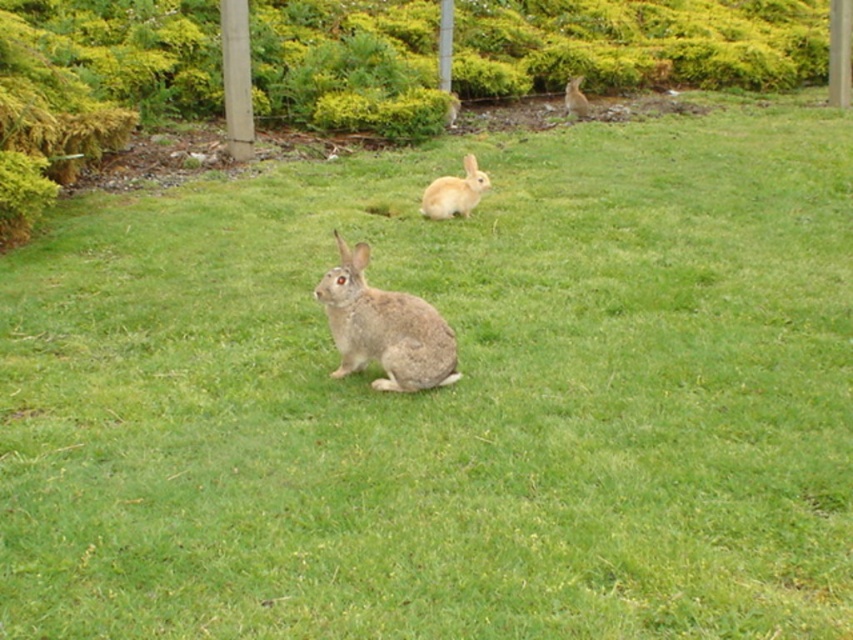
You are a photographer trying to capture a photo of the fuzzy brown rabbit at center and the fuzzy brown rabbit at upper center. Which rabbit would appear smaller in your photo?

The fuzzy brown rabbit at center appears smaller in the photo because it has a lesser height compared to the fuzzy brown rabbit at upper center.

You are standing in the grassy outdoor scene with three rabbits. You see a point marked at coordinates (384, 326). Which rabbit is located at that point?

The point marked at coordinates (384, 326) is where the fuzzy gray rabbit at center is located.